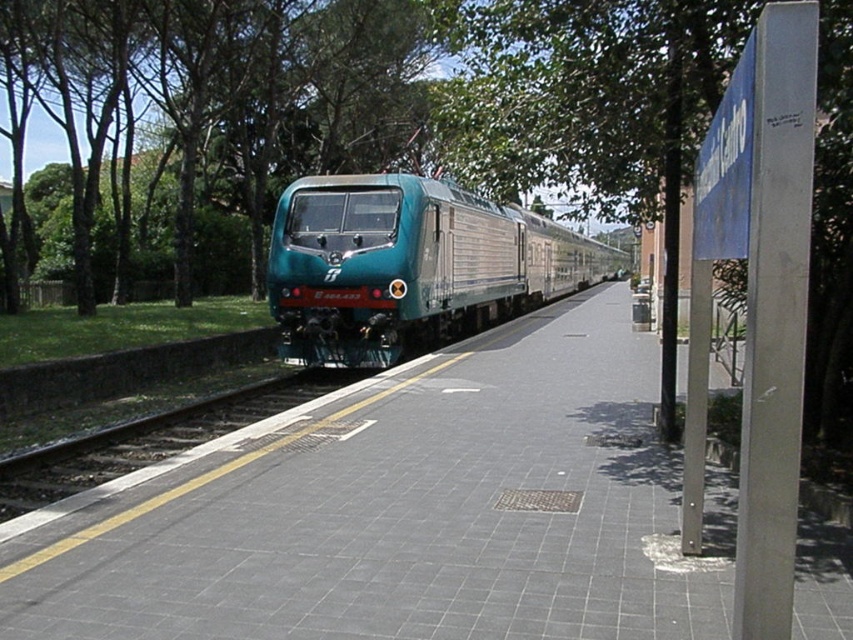
You are a passenger waiting on the platform and see the green leafy tree at upper center and the smooth concrete track at center. Which object is taller?

The green leafy tree at upper center is taller than the smooth concrete track at center.

You are a passenger waiting on the train station platform. You notice a green leafy tree at upper center and a teal glossy train at center. Which object is higher in the scene?

The green leafy tree at upper center is higher than the teal glossy train at center.

You are a maintenance worker checking the train station platform. You need to ensure the teal glossy train at center can fit within the smooth concrete track at center. Based on the scene, what is your assessment?

The teal glossy train at center is wider than the smooth concrete track at center, so it cannot fit within the track.